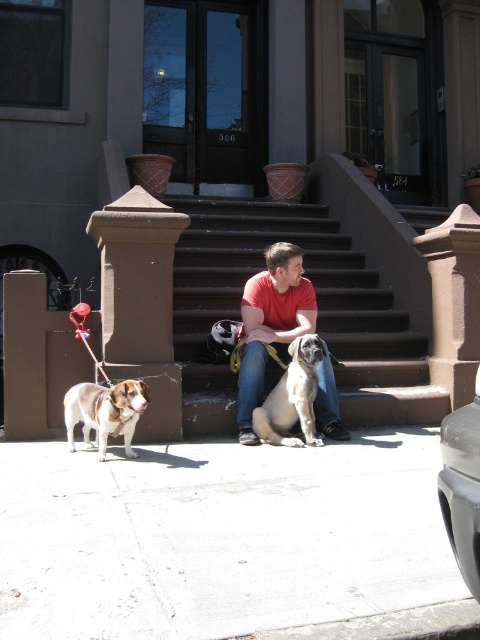
You are a delivery robot that needs to navigate to the entrance of the brownstone building. You see the white concrete pavement at lower center and the smooth gray dog at center. Which object is closer to the entrance?

The smooth gray dog at center is closer to the entrance than the white concrete pavement at lower center because the pavement is located below the dog, indicating the dog is positioned higher up near the entrance steps.

You are standing at the entrance of the brownstone building and want to walk to the white concrete pavement at lower center. Which direction should you go relative to the brown stone stairs at center?

The white concrete pavement at lower center is located below the brown stone stairs at center, so you should go downward towards the brown stone stairs at center to reach the white concrete pavement at lower center.